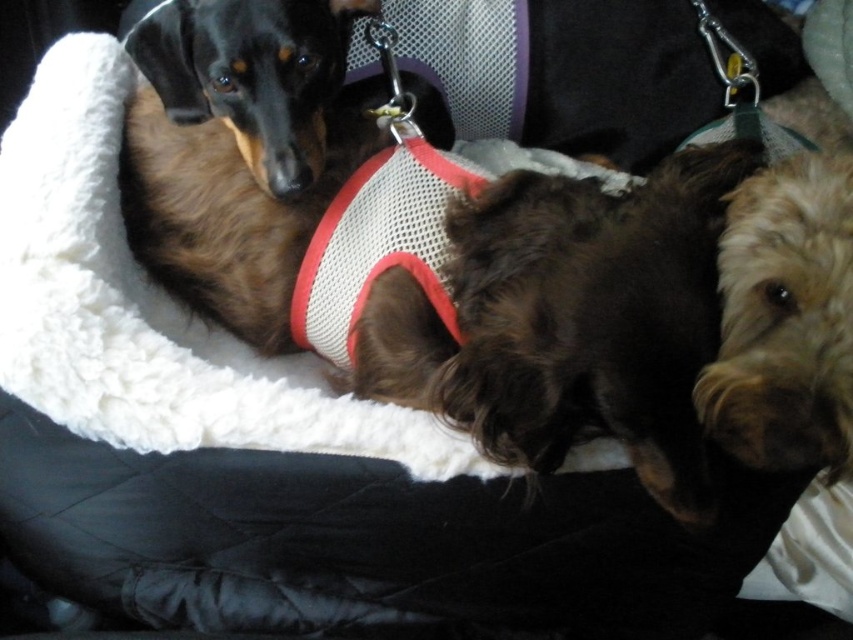
Which is below, mesh fabric harness at center or brown fur dog at upper left?

brown fur dog at upper left is below.

The height and width of the screenshot is (640, 853). In order to click on mesh fabric harness at center in this screenshot , I will do `click(582, 72)`.

In order to click on mesh fabric harness at center in this screenshot , I will do `click(582, 72)`.